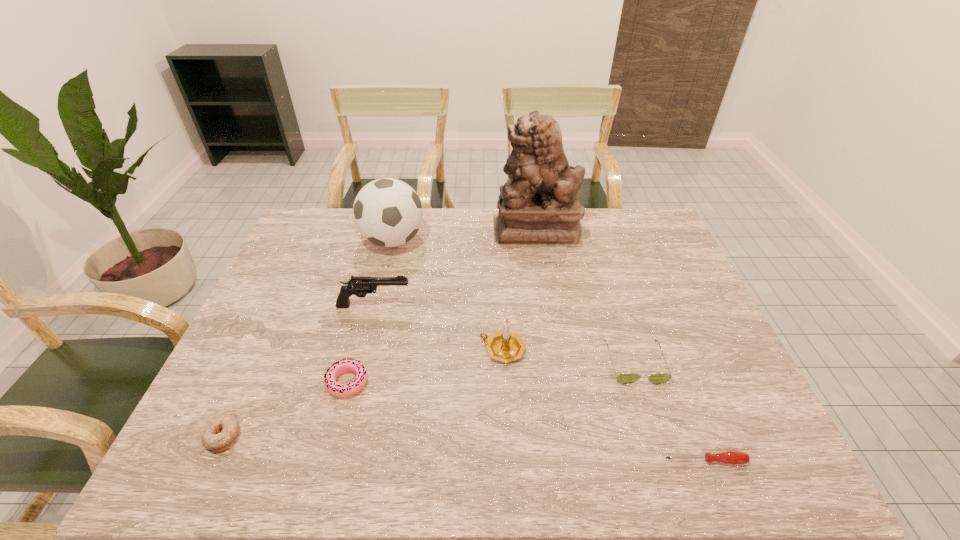
The image size is (960, 540). Identify the location of sculpture at the far edge. (540, 207).

This screenshot has height=540, width=960. Find the location of `soccer ball at the far edge`. soccer ball at the far edge is located at coordinates (387, 212).

At what (x,y) coordinates should I click in order to perform the action: click on doughnut that is at the near edge. Please return your answer as a coordinate pair (x, y). The width and height of the screenshot is (960, 540). Looking at the image, I should click on (221, 433).

This screenshot has width=960, height=540. Find the location of `screwdriver that is positioned at the near edge`. screwdriver that is positioned at the near edge is located at coordinates (730, 457).

You are a GUI agent. You are given a task and a screenshot of the screen. Output one action in this format:
    pyautogui.click(x=<x>, y=<y>)
    Task: Click on the object that is at the left edge
    The width and height of the screenshot is (960, 540).
    Given the screenshot: What is the action you would take?
    pyautogui.click(x=221, y=433)

The image size is (960, 540). Identify the location of object at the right edge. tap(730, 457).

At what (x,y) coordinates should I click in order to perform the action: click on object situated at the near left corner. Please return your answer as a coordinate pair (x, y). Looking at the image, I should click on (221, 433).

You are a GUI agent. You are given a task and a screenshot of the screen. Output one action in this format:
    pyautogui.click(x=<x>, y=<y>)
    Task: Click on the object situated at the near right corner
    
    Given the screenshot: What is the action you would take?
    pyautogui.click(x=730, y=457)

Locate an element on the screen. The height and width of the screenshot is (540, 960). vacant area at the far edge is located at coordinates (350, 220).

Identify the location of vacant region at the near edge of the desktop. (377, 445).